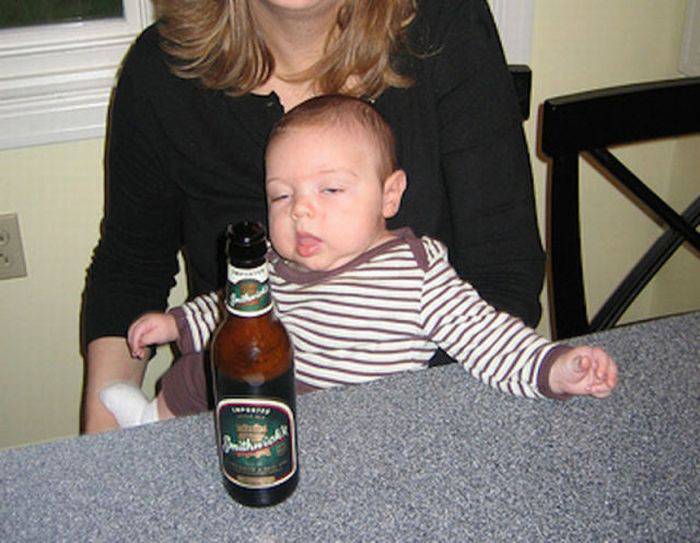
Locate an element on the screen. The image size is (700, 543). window is located at coordinates (22, 22).